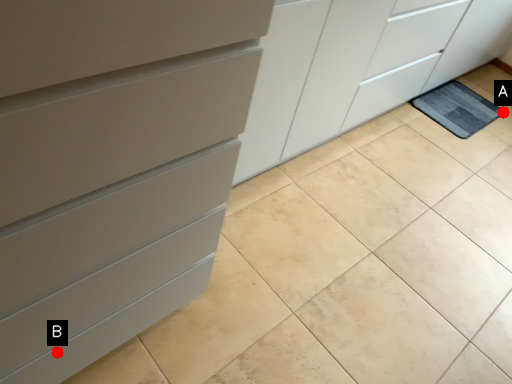
Question: Two points are circled on the image, labeled by A and B beside each circle. Which point is further to the camera?

Choices:
 (A) A is further
 (B) B is further

Answer: (A)